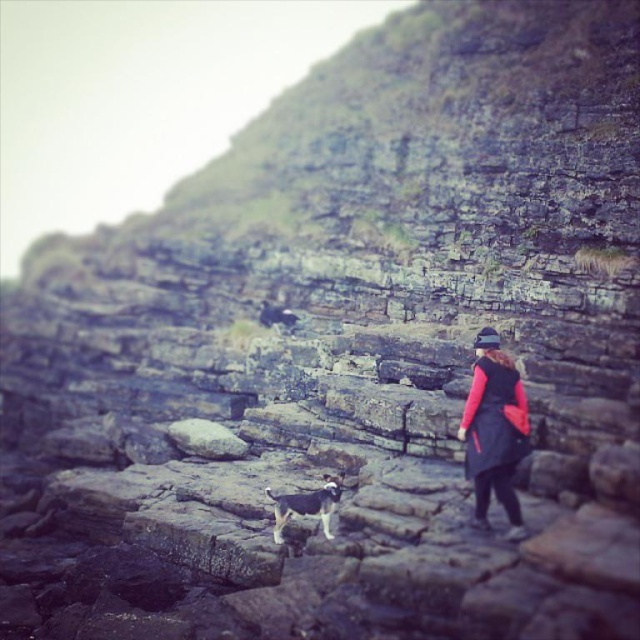
You are a hiker who needs to decide whether to pass between the dark red fabric jacket at right and the brown and white fur dog at center. Can you fit through the space between them if your backpack is 0.5 meters wide?

Result: The dark red fabric jacket at right has a lesser width compared to the brown and white fur dog at center. Since the jacket is narrower, the space between them might be sufficient for your backpack. However, without knowing the exact distance between them, it is uncertain if the 0.5 meters width will fit. You should check the distance between them first.

You are a hiker who wants to locate your dog. You see the dark red fabric jacket at right and the brown and white fur dog at center. Which object is higher in the image?

The dark red fabric jacket at right is located above the brown and white fur dog at center, so the dark red fabric jacket at right is higher in the image.